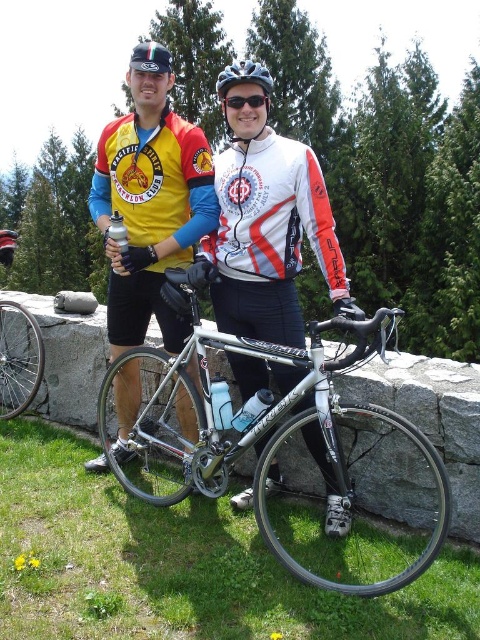
Between matte yellow jersey at left and white matte bicycle helmet at center, which one has less height?

Standing shorter between the two is matte yellow jersey at left.

Between matte yellow jersey at left and white matte bicycle helmet at center, which one appears on the left side from the viewer's perspective?

matte yellow jersey at left

Between point (139, 216) and point (230, 65), which one is positioned behind?

The point (230, 65) is more distant.

The width and height of the screenshot is (480, 640). I want to click on matte yellow jersey at left, so click(151, 202).

Between matte black helmet at center and white matte bicycle helmet at center, which one appears on the left side from the viewer's perspective?

Positioned to the left is matte black helmet at center.

Which is above, matte black helmet at center or white matte bicycle helmet at center?

white matte bicycle helmet at center is above.

Does point (229, 125) lie in front of point (232, 83)?

That is False.

Locate an element on the screen. matte black helmet at center is located at coordinates pyautogui.click(x=243, y=77).

Is silver metallic bicycle at center to the right of black matte goggles at center from the viewer's perspective?

Indeed, silver metallic bicycle at center is positioned on the right side of black matte goggles at center.

Between silver metallic bicycle at center and black matte goggles at center, which one has more height?

Standing taller between the two is silver metallic bicycle at center.

At what (x,y) coordinates should I click in order to perform the action: click on silver metallic bicycle at center. Please return your answer as a coordinate pair (x, y). The width and height of the screenshot is (480, 640). Looking at the image, I should click on (284, 442).

The height and width of the screenshot is (640, 480). What are the coordinates of `silver metallic bicycle at center` in the screenshot? It's located at tap(284, 442).